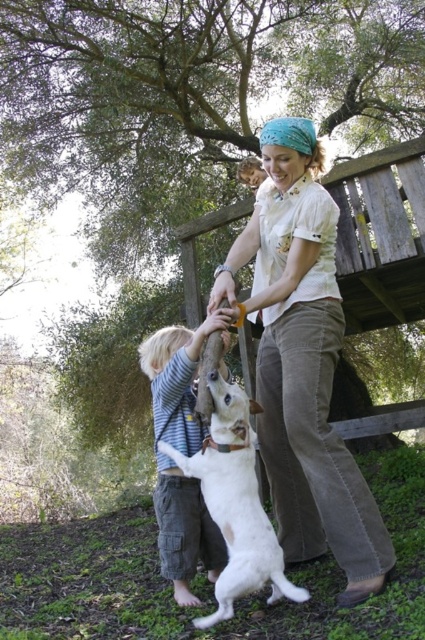
Question: Can you confirm if light beige corduroy pants at center is bigger than white fur dog at center?

Choices:
 (A) no
 (B) yes

Answer: (B)

Question: Which object is positioned closest to the striped cotton shirt at center?

Choices:
 (A) light beige corduroy pants at center
 (B) white fur dog at center

Answer: (B)

Question: Which of the following is the closest to the observer?

Choices:
 (A) striped cotton shirt at center
 (B) light beige corduroy pants at center
 (C) white fur dog at center

Answer: (C)

Question: Which of the following is the farthest from the observer?

Choices:
 (A) (295, 298)
 (B) (170, 371)
 (C) (255, 563)

Answer: (B)

Question: Does light beige corduroy pants at center have a greater width compared to striped cotton shirt at center?

Choices:
 (A) no
 (B) yes

Answer: (B)

Question: Does striped cotton shirt at center come in front of white fur dog at center?

Choices:
 (A) yes
 (B) no

Answer: (B)